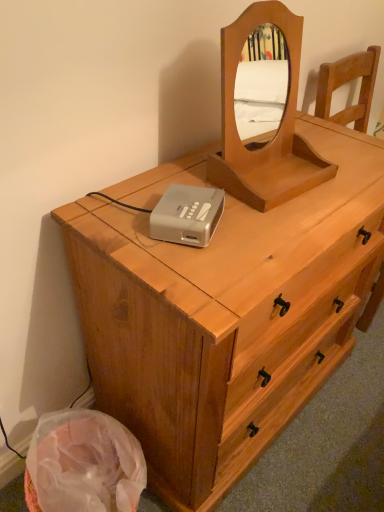
The image size is (384, 512). I want to click on empty space that is to the right of silver plastic cassette at center, so click(x=265, y=234).